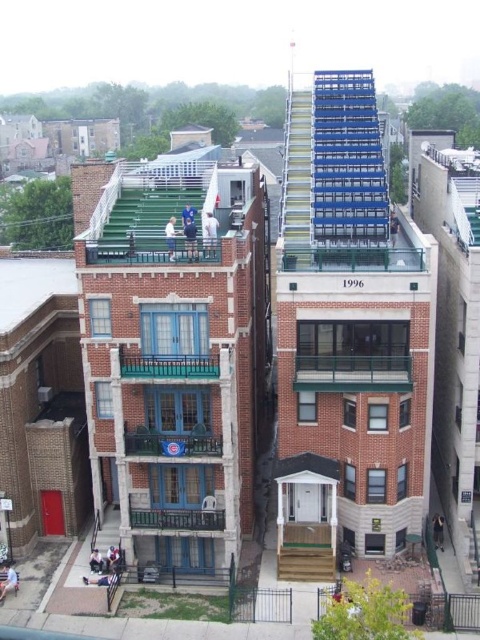
Question: Is green glass balcony at center bigger than green painted wood balcony at lower center?

Choices:
 (A) no
 (B) yes

Answer: (B)

Question: Does blue painted wood balcony at center lie in front of green painted wood balcony at lower center?

Choices:
 (A) yes
 (B) no

Answer: (A)

Question: Is green glass balcony at center wider than blue painted wood balcony at center?

Choices:
 (A) yes
 (B) no

Answer: (A)

Question: Among these objects, which one is farthest from the camera?

Choices:
 (A) blue painted wood balcony at center
 (B) green glass balcony at center
 (C) teal wrought iron balcony at center
 (D) green painted wood balcony at lower center

Answer: (D)

Question: Which object is the closest to the green painted wood balcony at lower center?

Choices:
 (A) teal wrought iron balcony at center
 (B) blue painted wood balcony at center
 (C) green glass balcony at center

Answer: (B)

Question: Which of the following is the farthest from the observer?

Choices:
 (A) green painted wood balcony at lower center
 (B) teal wrought iron balcony at center
 (C) green glass balcony at center

Answer: (A)